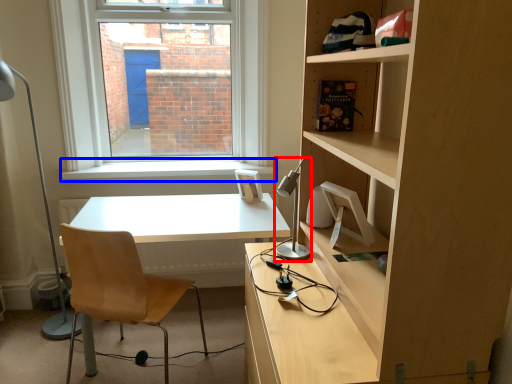
Question: Which of the following is the closest to the observer, table lamp (highlighted by a red box) or window sill (highlighted by a blue box)?

Choices:
 (A) table lamp
 (B) window sill

Answer: (A)